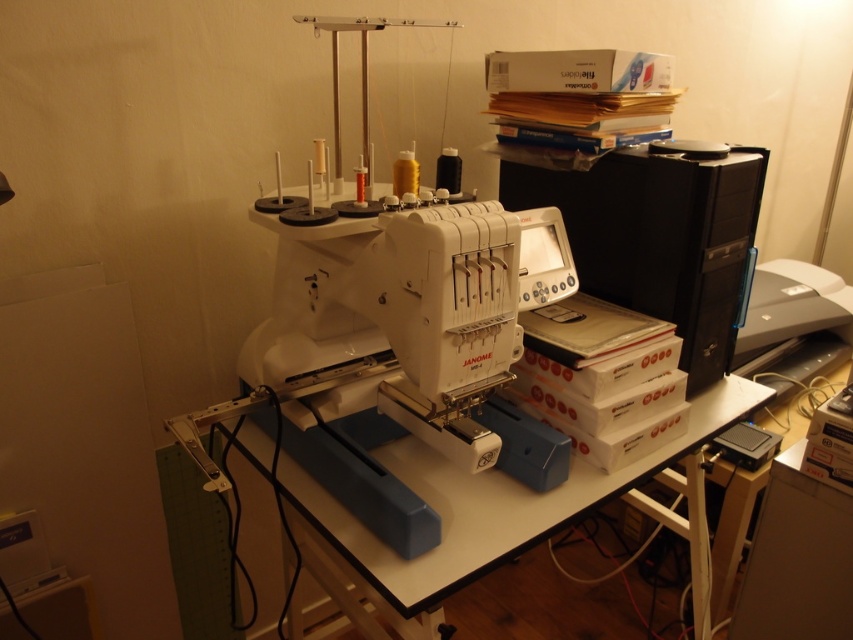
Which of these two, black plastic computer at right or white plastic table at center, stands shorter?

white plastic table at center

Can you confirm if black plastic computer at right is positioned below white plastic table at center?

No, black plastic computer at right is not below white plastic table at center.

Is point (553, 200) in front of point (403, 584)?

No, it is behind (403, 584).

Locate an element on the screen. The image size is (853, 640). black plastic computer at right is located at coordinates (654, 236).

Can you confirm if white plastic sewing machine at center is wider than white plastic table at center?

In fact, white plastic sewing machine at center might be narrower than white plastic table at center.

Does white plastic sewing machine at center have a lesser width compared to white plastic table at center?

Indeed, white plastic sewing machine at center has a lesser width compared to white plastic table at center.

At what (x,y) coordinates should I click in order to perform the action: click on white plastic sewing machine at center. Please return your answer as a coordinate pair (x, y). Image resolution: width=853 pixels, height=640 pixels. Looking at the image, I should click on (401, 353).

Locate an element on the screen. The width and height of the screenshot is (853, 640). white plastic sewing machine at center is located at coordinates (401, 353).

At what (x,y) coordinates should I click in order to perform the action: click on white plastic sewing machine at center. Please return your answer as a coordinate pair (x, y). Image resolution: width=853 pixels, height=640 pixels. Looking at the image, I should click on (401, 353).

Is the position of white plastic sewing machine at center more distant than that of black plastic computer at right?

No, white plastic sewing machine at center is closer to the viewer.

Is point (430, 433) positioned after point (695, 365)?

No, (430, 433) is in front of (695, 365).

Where is `white plastic sewing machine at center`? white plastic sewing machine at center is located at coordinates pyautogui.click(x=401, y=353).